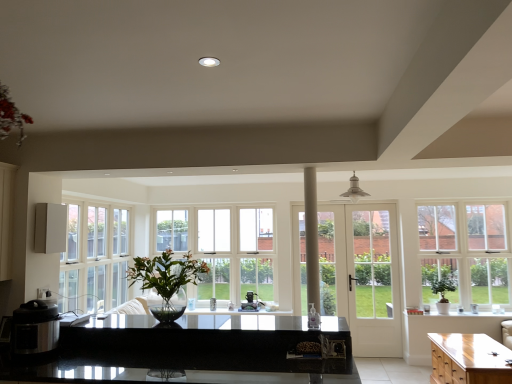
Question: Considering the relative positions of white glass window at right, placed as the second window when sorted from back to front, and satin black coffee maker at center, which ranks as the 1th appliance in back-to-front order, in the image provided, is white glass window at right, placed as the second window when sorted from back to front, to the left of satin black coffee maker at center, which ranks as the 1th appliance in back-to-front order, from the viewer's perspective?

Choices:
 (A) yes
 (B) no

Answer: (B)

Question: Is white glass window at right, marked as the first window in a right-to-left arrangement, far away from satin black coffee maker at center, which is the 1th appliance in right-to-left order?

Choices:
 (A) no
 (B) yes

Answer: (B)

Question: Is white glass window at right, placed as the second window when sorted from back to front, aimed at satin black coffee maker at center, which ranks as the 1th appliance in back-to-front order?

Choices:
 (A) yes
 (B) no

Answer: (B)

Question: Would you say white glass window at right, which is counted as the 2th window, starting from the left, contains satin black coffee maker at center, which is the 1th appliance from bottom to top?

Choices:
 (A) no
 (B) yes

Answer: (A)

Question: Is white glass window at right, placed as the second window when sorted from back to front, touching satin black coffee maker at center, which is the 1th appliance from bottom to top?

Choices:
 (A) yes
 (B) no

Answer: (B)

Question: Is point (x=441, y=286) closer or farther from the camera than point (x=394, y=218)?

Choices:
 (A) closer
 (B) farther

Answer: (A)

Question: Relative to white glass door at center, is green leafy plant at right, marked as the second houseplant in a top-to-bottom arrangement, in front or behind?

Choices:
 (A) front
 (B) behind

Answer: (A)

Question: From a real-world perspective, is green leafy plant at right, the second houseplant viewed from the left, positioned above or below white glass door at center?

Choices:
 (A) above
 (B) below

Answer: (B)

Question: In terms of height, does green leafy plant at right, marked as the second houseplant in a top-to-bottom arrangement, look taller or shorter compared to white glass door at center?

Choices:
 (A) tall
 (B) short

Answer: (B)

Question: In terms of height, does light brown wooden cabinet at lower right look taller or shorter compared to white glossy speaker at left, the 3th appliance viewed from the right?

Choices:
 (A) short
 (B) tall

Answer: (B)

Question: In terms of size, does light brown wooden cabinet at lower right appear bigger or smaller than white glossy speaker at left, positioned as the first appliance in left-to-right order?

Choices:
 (A) small
 (B) big

Answer: (B)

Question: Considering the positions of point (435, 372) and point (58, 235), is point (435, 372) closer or farther from the camera than point (58, 235)?

Choices:
 (A) farther
 (B) closer

Answer: (A)

Question: Is light brown wooden cabinet at lower right situated inside white glossy speaker at left, the 3th appliance viewed from the right, or outside?

Choices:
 (A) inside
 (B) outside

Answer: (B)

Question: Considering their positions, is white glass window at right, which is counted as the 2th window, starting from the left, located in front of or behind green leafy plant at right, marked as the second houseplant in a top-to-bottom arrangement?

Choices:
 (A) behind
 (B) front

Answer: (A)

Question: From a real-world perspective, is white glass window at right, which is counted as the 2th window, starting from the left, above or below green leafy plant at right, arranged as the 1th houseplant when viewed from the right?

Choices:
 (A) below
 (B) above

Answer: (B)